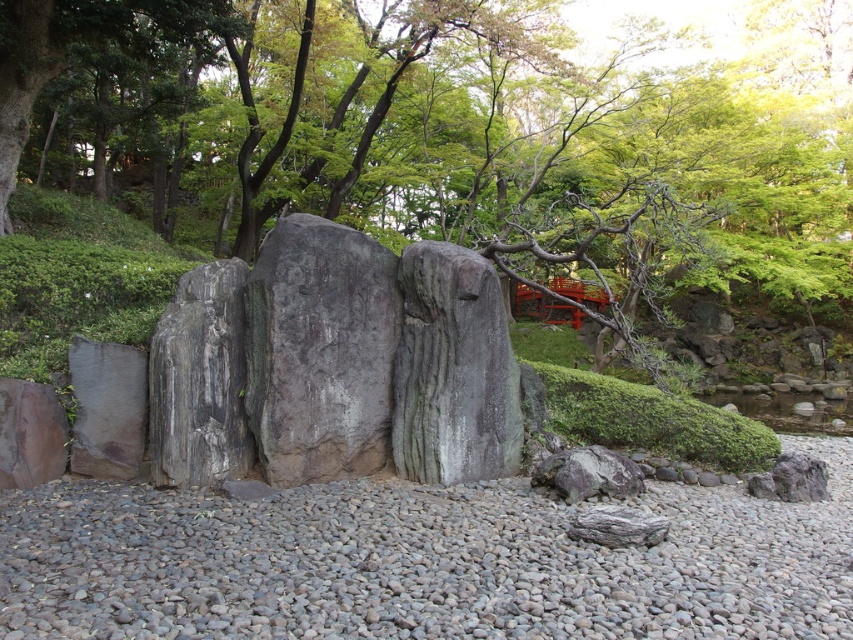
Question: Which point is farther to the camera?

Choices:
 (A) gray rough rock at center
 (B) gray gravel at center

Answer: (A)

Question: Can you confirm if gray gravel at center is wider than gray rough rock at center?

Choices:
 (A) no
 (B) yes

Answer: (B)

Question: Is gray gravel at center below gray rough rock at center?

Choices:
 (A) yes
 (B) no

Answer: (A)

Question: Which point is closer to the camera?

Choices:
 (A) gray gravel at center
 (B) gray rough rock at center

Answer: (A)

Question: Can you confirm if gray gravel at center is positioned to the left of gray rough rock at center?

Choices:
 (A) yes
 (B) no

Answer: (B)

Question: Which point appears farthest from the camera in this image?

Choices:
 (A) (460, 125)
 (B) (291, 259)

Answer: (A)